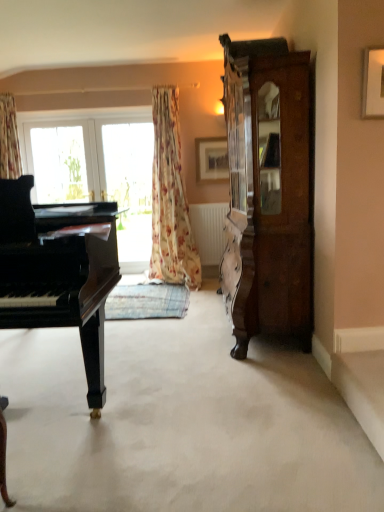
Question: Is black polished piano at left turned away from clear glass window at center?

Choices:
 (A) yes
 (B) no

Answer: (B)

Question: Does black polished piano at left have a greater height compared to clear glass window at center?

Choices:
 (A) yes
 (B) no

Answer: (A)

Question: From the image's perspective, would you say black polished piano at left is shown under clear glass window at center?

Choices:
 (A) no
 (B) yes

Answer: (B)

Question: Is clear glass window at center completely or partially inside black polished piano at left?

Choices:
 (A) yes
 (B) no

Answer: (B)

Question: Does black polished piano at left have a greater width compared to clear glass window at center?

Choices:
 (A) no
 (B) yes

Answer: (B)

Question: Is clear glass window at center taller or shorter than wooden picture frame at upper center, placed as the 2th picture frame when sorted from right to left?

Choices:
 (A) short
 (B) tall

Answer: (B)

Question: Is clear glass window at center wider or thinner than wooden picture frame at upper center, which is the 2th picture frame from front to back?

Choices:
 (A) wide
 (B) thin

Answer: (A)

Question: Is clear glass window at center in front of or behind wooden picture frame at upper center, placed as the 2th picture frame when sorted from right to left, in the image?

Choices:
 (A) front
 (B) behind

Answer: (B)

Question: Do you think clear glass window at center is within wooden picture frame at upper center, which is the first picture frame in back-to-front order, or outside of it?

Choices:
 (A) inside
 (B) outside

Answer: (B)

Question: From the image's perspective, is wooden picture frame at upper center, which is the first picture frame in back-to-front order, above or below floral fabric curtain at center?

Choices:
 (A) above
 (B) below

Answer: (A)

Question: Is wooden picture frame at upper center, placed as the 2th picture frame when sorted from right to left, wider or thinner than floral fabric curtain at center?

Choices:
 (A) thin
 (B) wide

Answer: (A)

Question: From a real-world perspective, is wooden picture frame at upper center, which is the first picture frame in back-to-front order, above or below floral fabric curtain at center?

Choices:
 (A) above
 (B) below

Answer: (A)

Question: Is point (218, 158) positioned closer to the camera than point (165, 240)?

Choices:
 (A) closer
 (B) farther

Answer: (B)

Question: In terms of width, does clear glass window at center look wider or thinner when compared to dark brown wood cabinet at right?

Choices:
 (A) thin
 (B) wide

Answer: (A)

Question: From a real-world perspective, is clear glass window at center positioned above or below dark brown wood cabinet at right?

Choices:
 (A) below
 (B) above

Answer: (A)